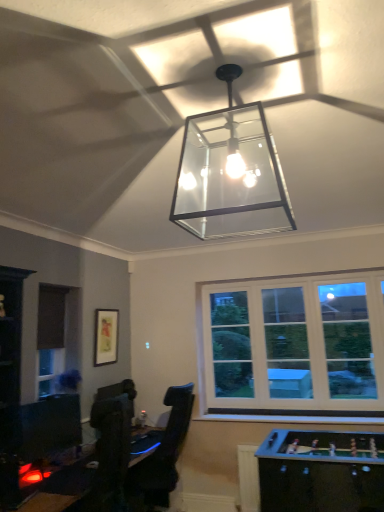
Question: From a real-world perspective, does matte black picture frame at upper left stand above black glossy table at lower left, the 1th table when ordered from left to right?

Choices:
 (A) no
 (B) yes

Answer: (B)

Question: Is matte black picture frame at upper left smaller than black glossy table at lower left, the 1th table when ordered from left to right?

Choices:
 (A) no
 (B) yes

Answer: (B)

Question: Considering the relative sizes of matte black picture frame at upper left and black glossy table at lower left, the 1th table when ordered from left to right, in the image provided, is matte black picture frame at upper left shorter than black glossy table at lower left, the 1th table when ordered from left to right,?

Choices:
 (A) no
 (B) yes

Answer: (A)

Question: Does matte black picture frame at upper left appear on the right side of black glossy table at lower left, the 1th table when ordered from left to right?

Choices:
 (A) yes
 (B) no

Answer: (B)

Question: Does matte black picture frame at upper left come in front of black glossy table at lower left, which appears as the 2th table when viewed from the right?

Choices:
 (A) no
 (B) yes

Answer: (A)

Question: Can black glossy table at lower left, the 1th table when ordered from left to right, be found inside matte black picture frame at upper left?

Choices:
 (A) no
 (B) yes

Answer: (A)

Question: From a real-world perspective, is clear glass pendant light at center under matte black picture frame at upper left?

Choices:
 (A) no
 (B) yes

Answer: (A)

Question: From the image's perspective, is clear glass pendant light at center on matte black picture frame at upper left?

Choices:
 (A) yes
 (B) no

Answer: (A)

Question: Is clear glass pendant light at center closer to camera compared to matte black picture frame at upper left?

Choices:
 (A) yes
 (B) no

Answer: (A)

Question: Can you confirm if clear glass pendant light at center is wider than matte black picture frame at upper left?

Choices:
 (A) no
 (B) yes

Answer: (B)

Question: Is clear glass pendant light at center not inside matte black picture frame at upper left?

Choices:
 (A) no
 (B) yes

Answer: (B)

Question: Is clear glass pendant light at center facing away from matte black picture frame at upper left?

Choices:
 (A) no
 (B) yes

Answer: (A)

Question: From a real-world perspective, is black glossy table at lower left, the 1th table when ordered from left to right, physically below matte black picture frame at upper left?

Choices:
 (A) yes
 (B) no

Answer: (A)